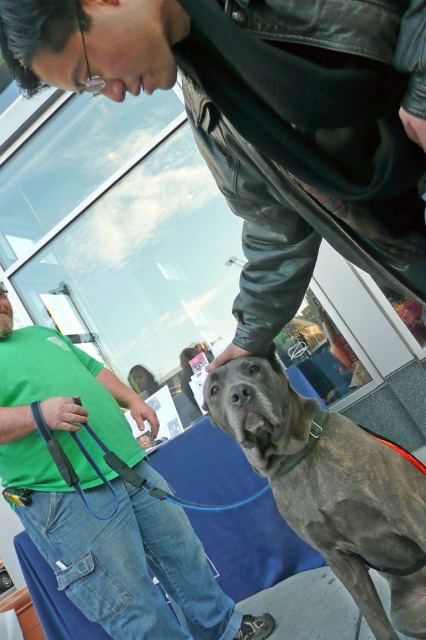
Can you confirm if leather jacket at upper center is positioned above green cotton shirt at lower left?

Correct, leather jacket at upper center is located above green cotton shirt at lower left.

Describe the element at coordinates (267, 122) in the screenshot. Image resolution: width=426 pixels, height=640 pixels. I see `leather jacket at upper center` at that location.

Between point (308, 118) and point (34, 492), which one is positioned in front?

Point (308, 118) is more forward.

Identify the location of leather jacket at upper center. pyautogui.click(x=267, y=122).

Is leather jacket at upper center in front of gray brindle dog at center?

Yes, leather jacket at upper center is closer to the viewer.

Which is in front, point (71, 20) or point (345, 502)?

Point (71, 20) is more forward.

What do you see at coordinates (267, 122) in the screenshot?
I see `leather jacket at upper center` at bounding box center [267, 122].

The image size is (426, 640). Find the location of `leather jacket at upper center`. leather jacket at upper center is located at coordinates (267, 122).

Is green cotton shirt at lower left positioned behind gray brindle dog at center?

Yes, green cotton shirt at lower left is behind gray brindle dog at center.

Does green cotton shirt at lower left appear over gray brindle dog at center?

Incorrect, green cotton shirt at lower left is not positioned above gray brindle dog at center.

Where is `green cotton shirt at lower left`? The width and height of the screenshot is (426, 640). green cotton shirt at lower left is located at coordinates (103, 499).